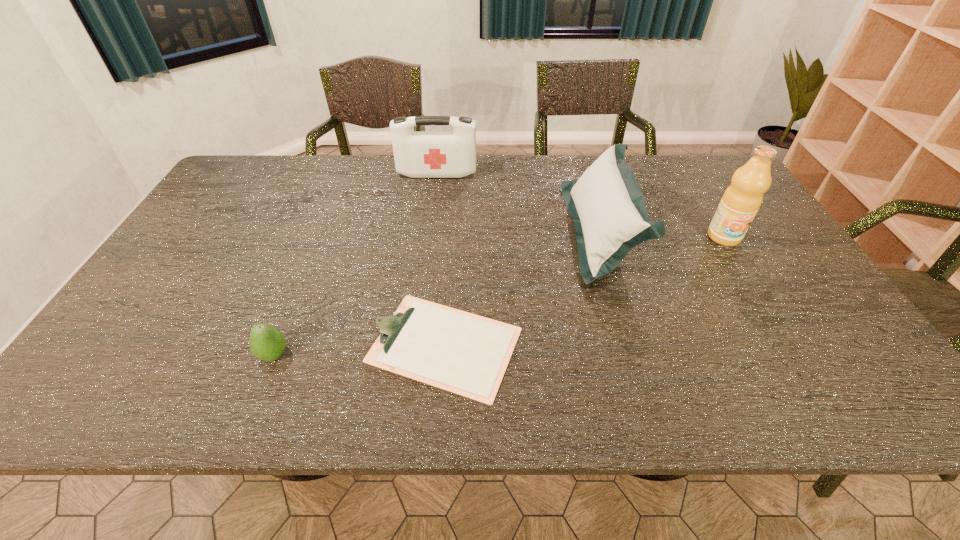
In order to click on vacant point at the left edge in this screenshot , I will do `click(94, 355)`.

In the image, there is a desktop. Where is `free region at the right edge`? This screenshot has height=540, width=960. free region at the right edge is located at coordinates (804, 330).

Where is `vacant space at the far left corner of the desktop`? vacant space at the far left corner of the desktop is located at coordinates (255, 188).

The height and width of the screenshot is (540, 960). I want to click on vacant space at the far right corner of the desktop, so click(x=700, y=174).

The height and width of the screenshot is (540, 960). Identify the location of unoccupied area between the fourth object from left to right and the avocado. (438, 293).

Where is `vacant space that's between the leftmost object and the rightmost object`? vacant space that's between the leftmost object and the rightmost object is located at coordinates (499, 296).

The image size is (960, 540). Identify the location of vacant area between the fruit juice and the shortest object. coord(585,291).

Locate an element on the screen. Image resolution: width=960 pixels, height=540 pixels. unoccupied area between the fruit juice and the leftmost object is located at coordinates (499, 296).

Where is `empty space between the clipboard and the farthest object`? This screenshot has height=540, width=960. empty space between the clipboard and the farthest object is located at coordinates (441, 259).

Locate an element on the screen. This screenshot has height=540, width=960. unoccupied position between the first-aid kit and the avocado is located at coordinates (356, 265).